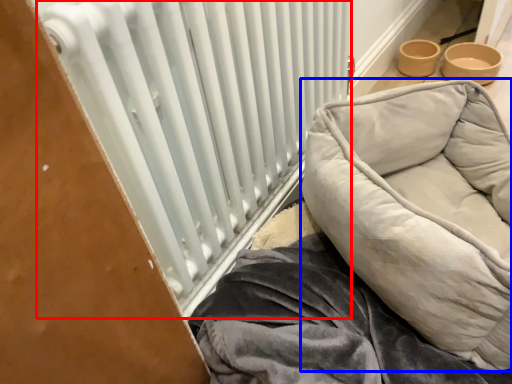
Question: Which object is closer to the camera taking this photo, radiator (highlighted by a red box) or furniture (highlighted by a blue box)?

Choices:
 (A) radiator
 (B) furniture

Answer: (A)